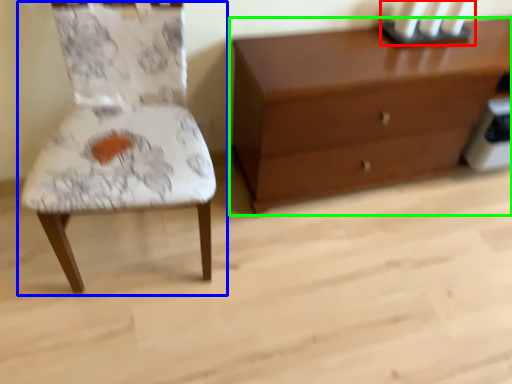
Question: Which is nearer to the candle holder (highlighted by a red box)? chair (highlighted by a blue box) or chest of drawers (highlighted by a green box).

Choices:
 (A) chair
 (B) chest of drawers

Answer: (B)